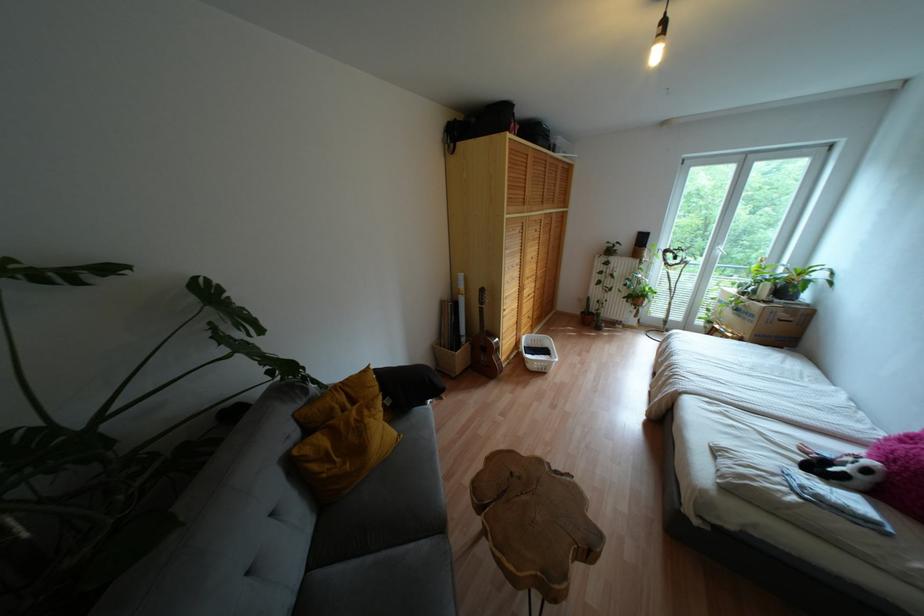
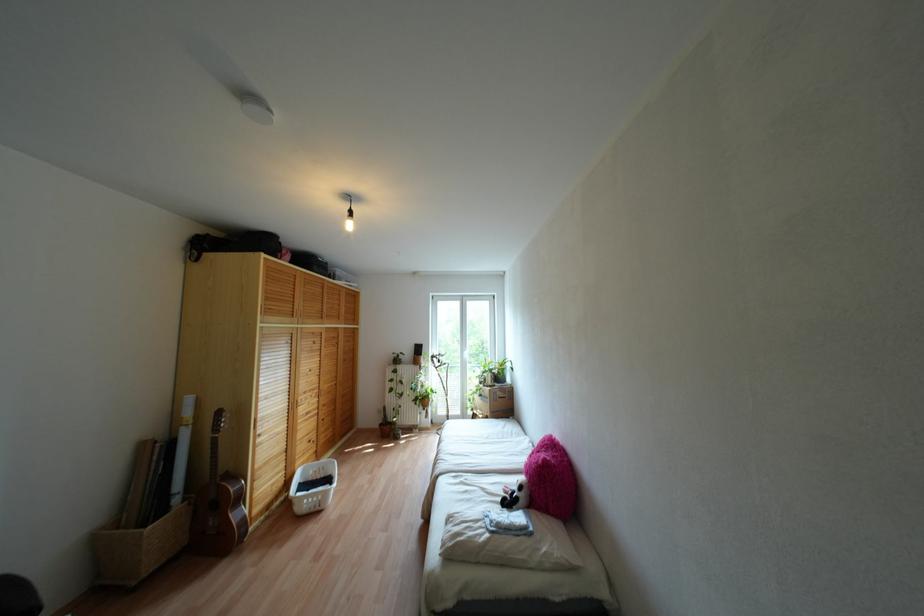
Locate, in the second image, the point that corresponds to the point at 538,272 in the first image.

(324, 387)